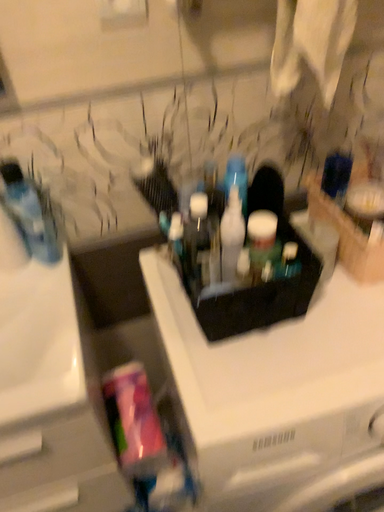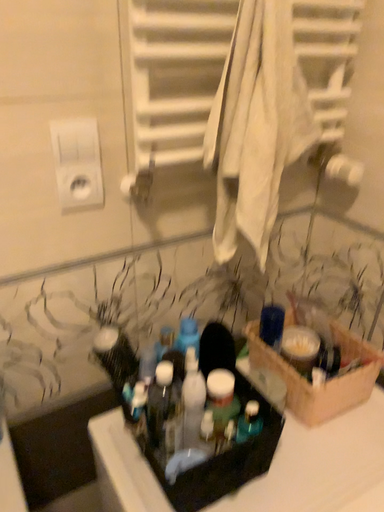
Question: How did the camera likely rotate when shooting the video?

Choices:
 (A) rotated right
 (B) rotated left

Answer: (A)